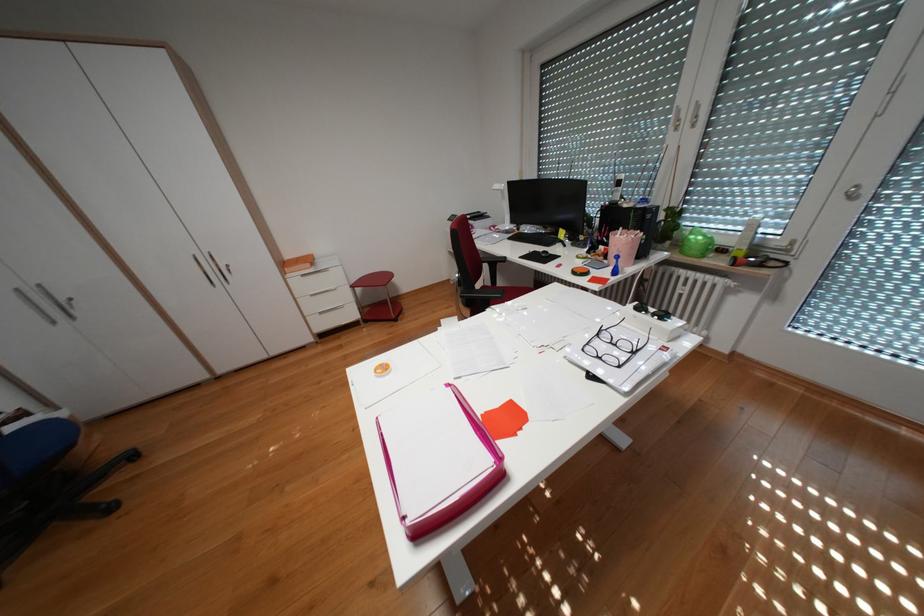
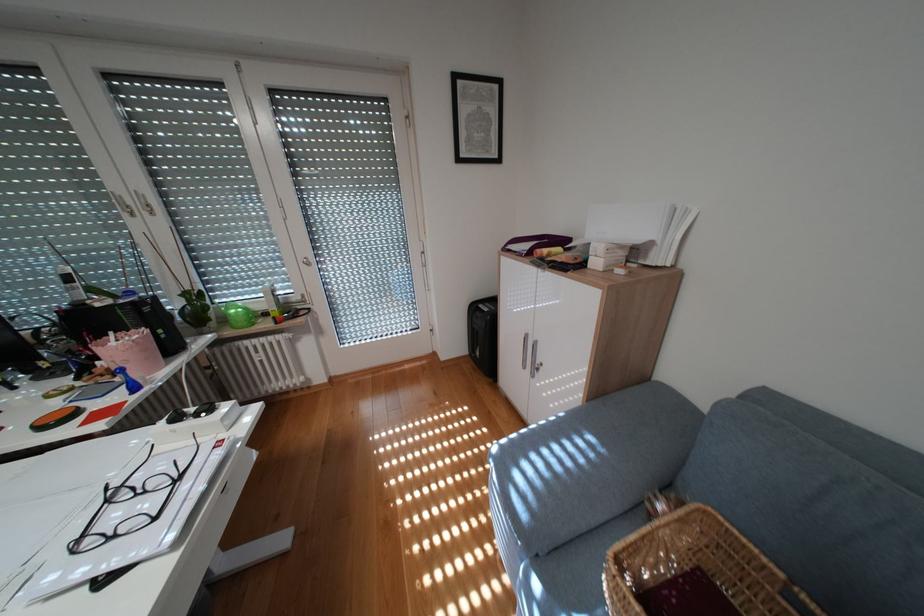
Where in the second image is the point corresponding to pixel 610 334 from the first image?

(119, 501)